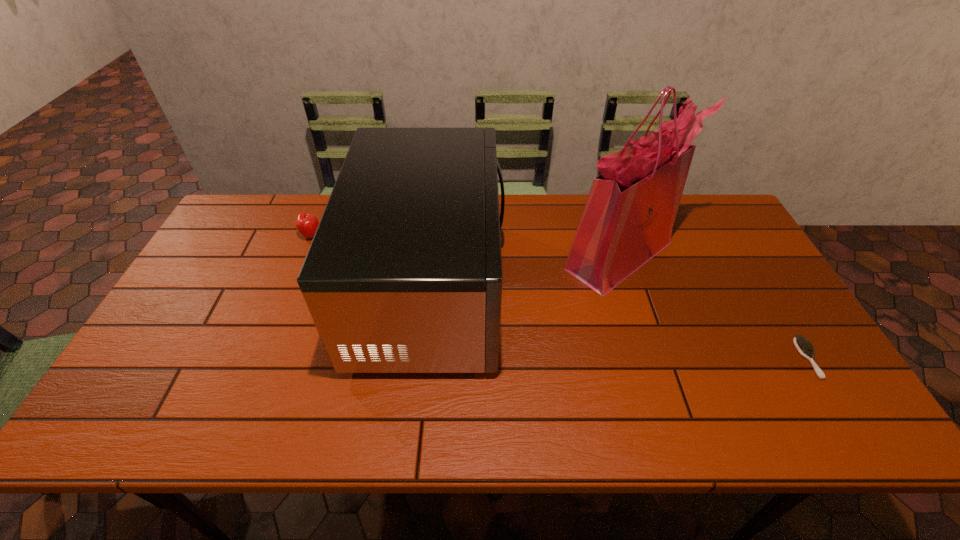
Where is `vacant region located on the back of the apple`? Image resolution: width=960 pixels, height=540 pixels. vacant region located on the back of the apple is located at coordinates (321, 212).

Locate an element on the screen. The image size is (960, 540). free space located on the back of the rightmost object is located at coordinates (771, 298).

Locate an element on the screen. The image size is (960, 540). shopping bag present at the far edge is located at coordinates (628, 218).

The width and height of the screenshot is (960, 540). Identify the location of microwave oven located in the far edge section of the desktop. (404, 273).

Where is `apple present at the far edge`? apple present at the far edge is located at coordinates (306, 223).

Identify the location of object present at the right edge. Image resolution: width=960 pixels, height=540 pixels. (805, 348).

At what (x,y) coordinates should I click in order to perform the action: click on vacant region at the far edge of the desktop. Please return your answer as a coordinate pair (x, y). The height and width of the screenshot is (540, 960). Looking at the image, I should click on (294, 215).

In the image, there is a desktop. Where is `vacant region at the near edge`? This screenshot has width=960, height=540. vacant region at the near edge is located at coordinates (204, 406).

This screenshot has width=960, height=540. In order to click on vacant point at the left edge in this screenshot , I will do `click(183, 396)`.

I want to click on free space at the right edge of the desktop, so click(733, 258).